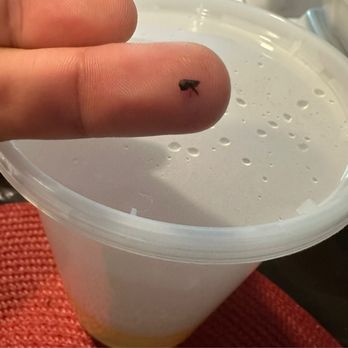
The height and width of the screenshot is (348, 348). Find the location of `plastic container`. plastic container is located at coordinates (148, 283).